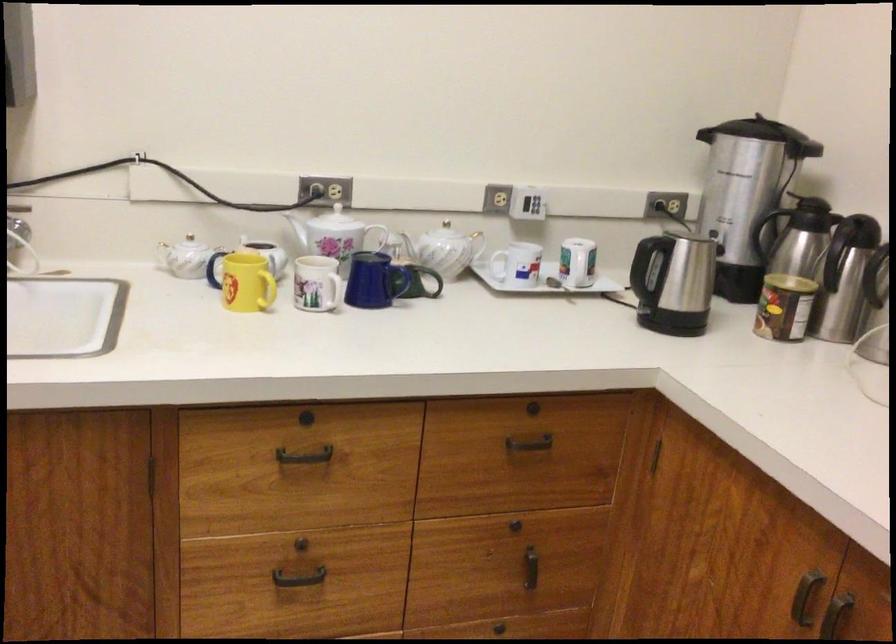
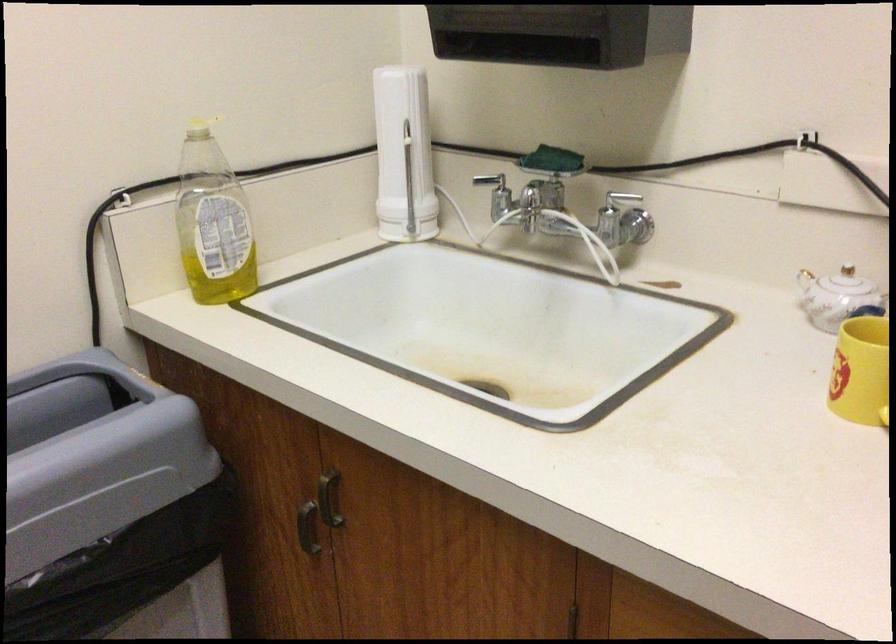
In the second image, find the point that corresponds to (x=196, y=251) in the first image.

(848, 287)